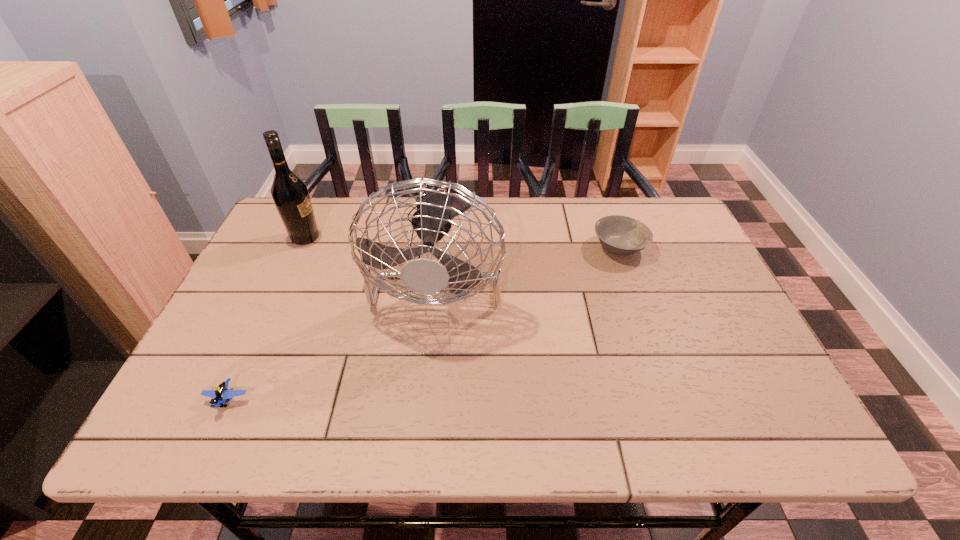
Find the location of a particular element. The image size is (960, 540). object that is at the near edge is located at coordinates (222, 392).

The image size is (960, 540). Identify the location of wine bottle at the left edge. (290, 194).

Where is `Lego located at the left edge`? Lego located at the left edge is located at coordinates (222, 392).

Find the location of a particular element. The width and height of the screenshot is (960, 540). object that is at the right edge is located at coordinates (621, 235).

Locate an element on the screen. The width and height of the screenshot is (960, 540). object positioned at the far left corner is located at coordinates (290, 194).

You are a GUI agent. You are given a task and a screenshot of the screen. Output one action in this format:
    pyautogui.click(x=<x>, y=<y>)
    Task: Click on the object that is positioned at the near left corner
    
    Given the screenshot: What is the action you would take?
    [222, 392]

The height and width of the screenshot is (540, 960). Find the location of `object situated at the far right corner`. object situated at the far right corner is located at coordinates point(621,235).

The width and height of the screenshot is (960, 540). In order to click on vacant space at the far edge in this screenshot , I will do `click(333, 215)`.

You are a GUI agent. You are given a task and a screenshot of the screen. Output one action in this format:
    pyautogui.click(x=<x>, y=<y>)
    Task: Click on the vacant space at the near edge of the desktop
    Image resolution: width=960 pixels, height=540 pixels.
    Given the screenshot: What is the action you would take?
    [x=363, y=415]

Locate an element on the screen. Image resolution: width=960 pixels, height=540 pixels. vacant position at the left edge of the desktop is located at coordinates (236, 329).